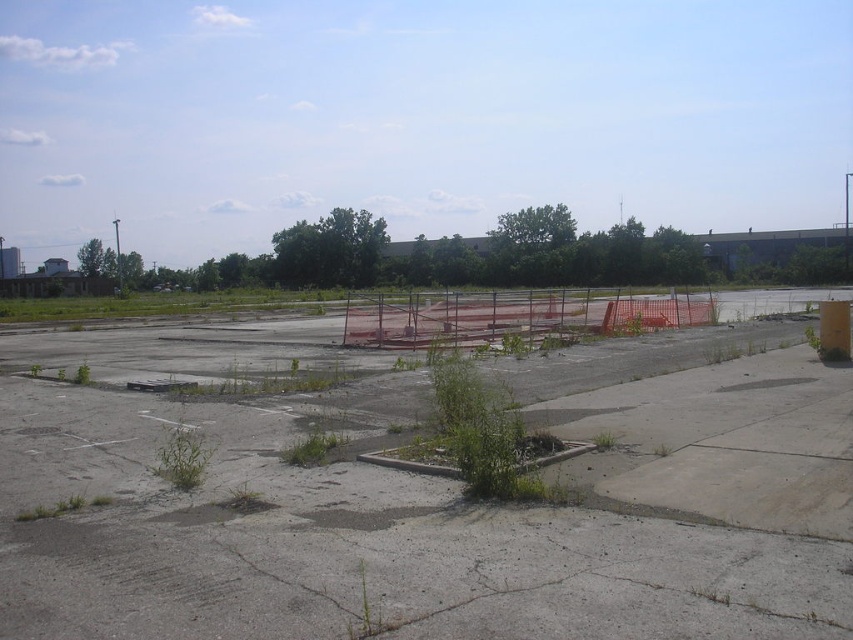
You are a delivery person trying to navigate through the abandoned parking lot. You need to pass between the orange mesh fence at center and the green leafy plant at center. Can you estimate if there is enough space for your 1.5 meter wide delivery cart?

The orange mesh fence at center is wider than the green leafy plant at center. However, the exact distance between them isn

Consider the image. You are standing at the edge of the abandoned lot and see the green leafy plant at center and the green grassy weed at lower left. Which one is positioned to the right side?

The green leafy plant at center is positioned to the right of the green grassy weed at lower left.